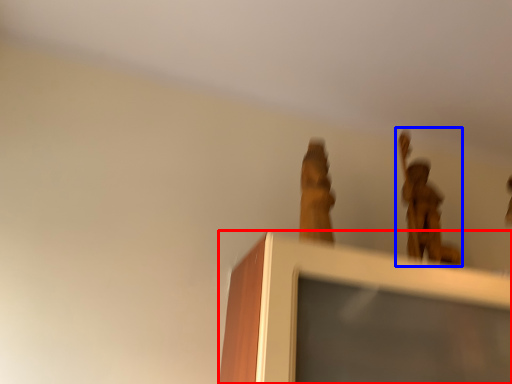
Question: Which of the following is the closest to the observer, furniture (highlighted by a red box) or bronze statue (highlighted by a blue box)?

Choices:
 (A) furniture
 (B) bronze statue

Answer: (A)